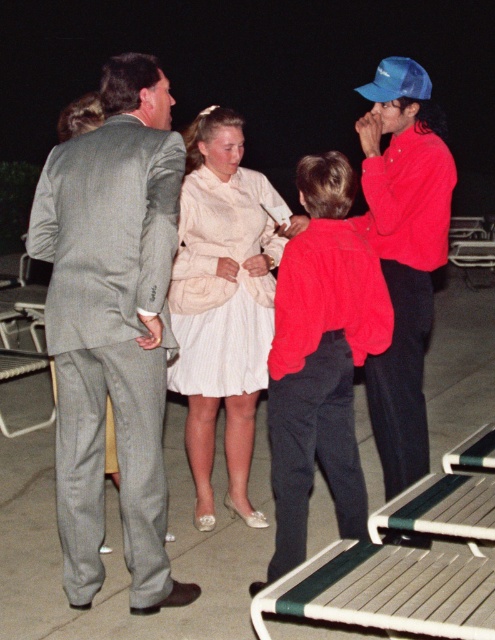
You are a photographer standing at the edge of the paved area where the lounge chairs are located. You want to take a photo of the white striped fabric dress at center and the blue matte baseball cap at upper right in the same frame. Given that your camera has a maximum focus range of 4 feet, will both subjects be in focus?

The distance between the white striped fabric dress at center and the blue matte baseball cap at upper right is 4.13 feet, which exceeds the camera maximum focus range of 4 feet. Therefore, both subjects cannot be in focus simultaneously.